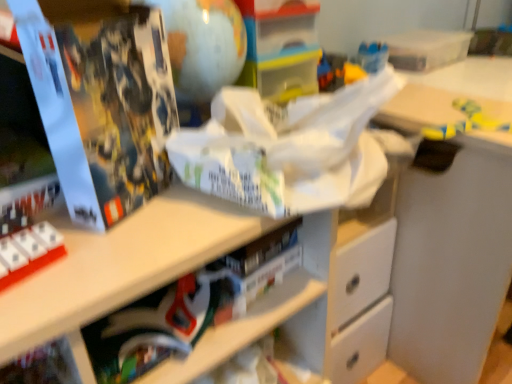
The image size is (512, 384). Identify the location of vacant area that is in front of matte black book at left. (110, 252).